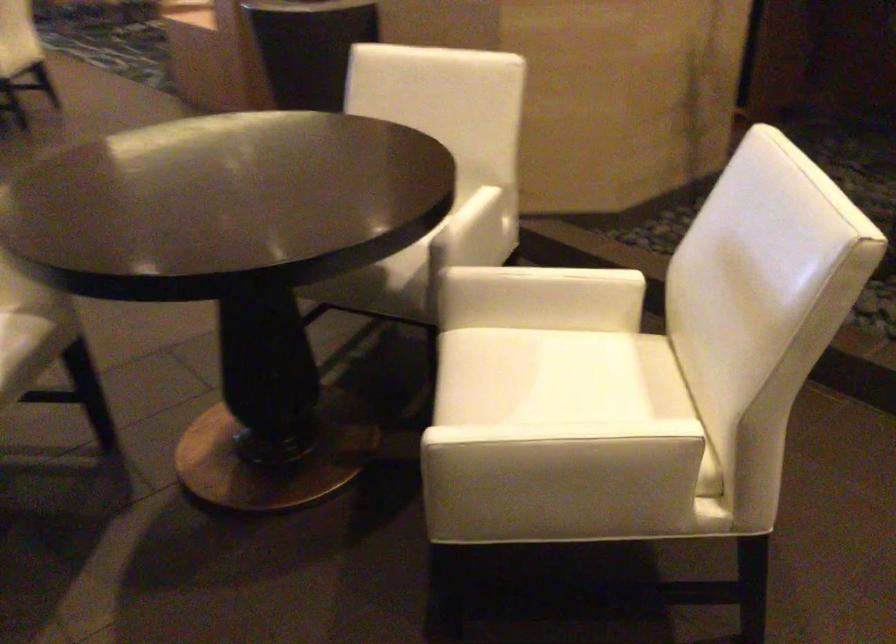
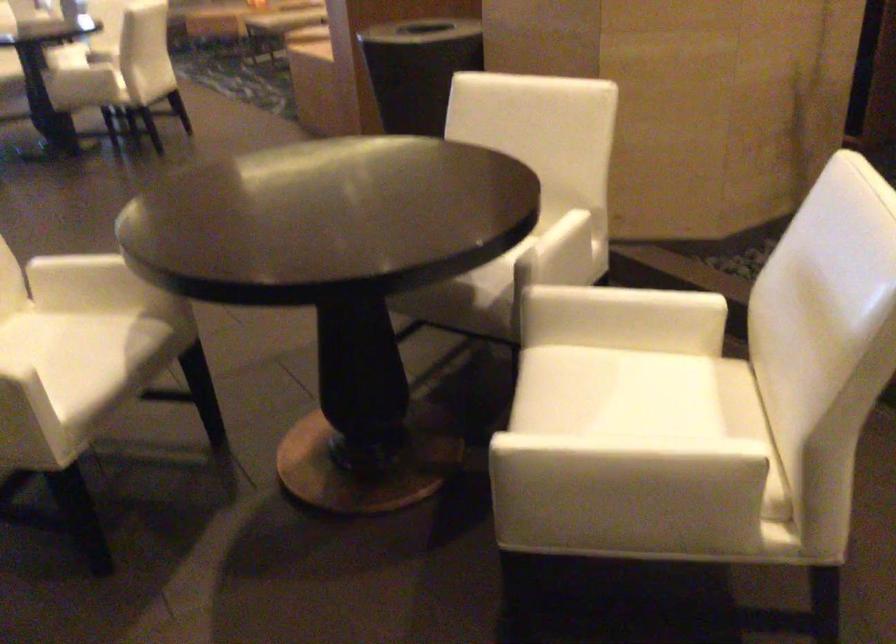
Locate, in the second image, the point that corresponds to pixel 478 210 in the first image.

(567, 232)